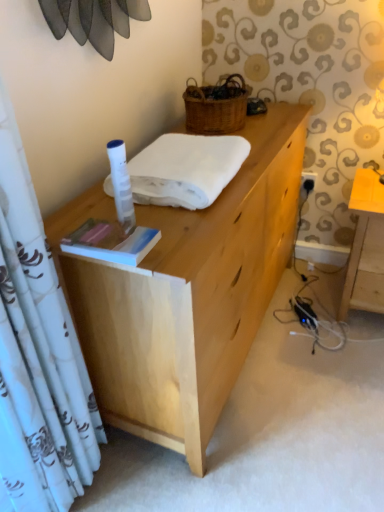
I want to click on natural wood desk at center, so click(x=186, y=292).

Locate an element on the screen. This screenshot has height=512, width=384. white floral fabric curtain at left is located at coordinates (37, 357).

Describe the element at coordinates (216, 106) in the screenshot. I see `woven brown picnic basket at upper center` at that location.

What is the approximate height of light brown wooden table at right?

light brown wooden table at right is 23.56 inches tall.

The width and height of the screenshot is (384, 512). Describe the element at coordinates (365, 247) in the screenshot. I see `light brown wooden table at right` at that location.

Where is `white plastic power outlet at lower right`? The height and width of the screenshot is (512, 384). white plastic power outlet at lower right is located at coordinates (308, 181).

Find the location of a particular element. This screenshot has width=384, height=512. hardcover book at center is located at coordinates (111, 241).

Is woven brown picnic basket at upper center bigger or smaller than white soft towel at center?

Clearly, woven brown picnic basket at upper center is smaller in size than white soft towel at center.

From the picture: How far apart are woven brown picnic basket at upper center and white soft towel at center?

woven brown picnic basket at upper center and white soft towel at center are 39.42 centimeters apart.

I want to click on picnic basket that is on the right side of white soft towel at center, so click(x=216, y=106).

Does woven brown picnic basket at upper center have a lesser width compared to white soft towel at center?

Indeed, woven brown picnic basket at upper center has a lesser width compared to white soft towel at center.

Is white soft towel at center in contact with woven brown picnic basket at upper center?

They are not placed beside each other.

Looking at their sizes, would you say white soft towel at center is wider or thinner than woven brown picnic basket at upper center?

Considering their sizes, white soft towel at center looks broader than woven brown picnic basket at upper center.

Measure the distance from white soft towel at center to woven brown picnic basket at upper center.

white soft towel at center is 15.52 inches away from woven brown picnic basket at upper center.

Who is more distant, white soft towel at center or woven brown picnic basket at upper center?

woven brown picnic basket at upper center is further away from the camera.

Does hardcover book at center appear on the right side of white floral fabric curtain at left?

Indeed, hardcover book at center is positioned on the right side of white floral fabric curtain at left.

Is hardcover book at center behind white floral fabric curtain at left?

Yes, it is behind white floral fabric curtain at left.

From the image's perspective, is hardcover book at center beneath white floral fabric curtain at left?

No, from the image's perspective, hardcover book at center is not beneath white floral fabric curtain at left.

Measure the distance from hardcover book at center to white floral fabric curtain at left.

14.01 inches.

What are the coordinates of `power outlet lying below the woven brown picnic basket at upper center (from the image's perspective)` in the screenshot? It's located at (308, 181).

Can you tell me how much white plastic power outlet at lower right and woven brown picnic basket at upper center differ in facing direction?

91.1 degrees separate the facing orientations of white plastic power outlet at lower right and woven brown picnic basket at upper center.

Is there a large distance between white plastic power outlet at lower right and woven brown picnic basket at upper center?

No, white plastic power outlet at lower right is not far away from woven brown picnic basket at upper center.

Considering the sizes of objects light brown wooden table at right and white floral fabric curtain at left in the image provided, who is smaller, light brown wooden table at right or white floral fabric curtain at left?

Smaller between the two is white floral fabric curtain at left.

From a real-world perspective, is light brown wooden table at right over white floral fabric curtain at left?

No, from a real-world perspective, light brown wooden table at right is not on top of white floral fabric curtain at left.

In order to click on curtain above the light brown wooden table at right (from a real-world perspective) in this screenshot , I will do `click(37, 357)`.

Could you tell me if white soft towel at center is facing natural wood desk at center?

No, white soft towel at center is not aimed at natural wood desk at center.

From a real-world perspective, is white soft towel at center under natural wood desk at center?

No, from a real-world perspective, white soft towel at center is not beneath natural wood desk at center.

How different are the orientations of white soft towel at center and natural wood desk at center in degrees?

They differ by 0.721 degrees in their facing directions.

Considering the relative sizes of white soft towel at center and natural wood desk at center in the image provided, is white soft towel at center bigger than natural wood desk at center?

No.

Considering the relative positions of white soft towel at center and white floral fabric curtain at left in the image provided, is white soft towel at center to the right of white floral fabric curtain at left from the viewer's perspective?

Indeed, white soft towel at center is positioned on the right side of white floral fabric curtain at left.

Between white soft towel at center and white floral fabric curtain at left, which one has smaller size?

With smaller size is white soft towel at center.

Is white soft towel at center shorter than white floral fabric curtain at left?

Yes.

Is white soft towel at center completely or partially outside of white floral fabric curtain at left?

white soft towel at center lies outside white floral fabric curtain at left's area.

The image size is (384, 512). Identify the location of linen lying in front of the woven brown picnic basket at upper center. (186, 169).

Image resolution: width=384 pixels, height=512 pixels. Find the location of `linen on the left of woven brown picnic basket at upper center`. linen on the left of woven brown picnic basket at upper center is located at coordinates (186, 169).

Estimate the real-world distances between objects in this image. Which object is further from hardcover book at center, white floral fabric curtain at left or white plastic power outlet at lower right?

Based on the image, white plastic power outlet at lower right appears to be further to hardcover book at center.

Looking at the image, which one is located closer to woven brown picnic basket at upper center, hardcover book at center or white soft towel at center?

The object closer to woven brown picnic basket at upper center is white soft towel at center.

Based on their spatial positions, is white soft towel at center or white plastic power outlet at lower right closer to light brown wooden table at right?

white plastic power outlet at lower right.

Considering their positions, is light brown wooden table at right positioned further to white plastic power outlet at lower right than natural wood desk at center?

natural wood desk at center.

Looking at the image, which one is located further to woven brown picnic basket at upper center, white soft towel at center or white floral fabric curtain at left?

Among the two, white floral fabric curtain at left is located further to woven brown picnic basket at upper center.

Looking at this image, when comparing their distances from white floral fabric curtain at left, does woven brown picnic basket at upper center or white plastic power outlet at lower right seem further?

The object further to white floral fabric curtain at left is white plastic power outlet at lower right.

Estimate the real-world distances between objects in this image. Which object is closer to white plastic power outlet at lower right, white floral fabric curtain at left or woven brown picnic basket at upper center?

The object closer to white plastic power outlet at lower right is woven brown picnic basket at upper center.

Based on their spatial positions, is hardcover book at center or woven brown picnic basket at upper center closer to white soft towel at center?

The object closer to white soft towel at center is hardcover book at center.

You are a GUI agent. You are given a task and a screenshot of the screen. Output one action in this format:
    pyautogui.click(x=<x>, y=<y>)
    Task: Click on the picnic basket situated between hardcover book at center and light brown wooden table at right from left to right
    
    Given the screenshot: What is the action you would take?
    pyautogui.click(x=216, y=106)

You are a GUI agent. You are given a task and a screenshot of the screen. Output one action in this format:
    pyautogui.click(x=<x>, y=<y>)
    Task: Click on the linen located between hardcover book at center and white plastic power outlet at lower right in the depth direction
    This screenshot has width=384, height=512.
    Given the screenshot: What is the action you would take?
    pyautogui.click(x=186, y=169)

Locate an element on the screen. This screenshot has height=512, width=384. linen positioned between natural wood desk at center and white plastic power outlet at lower right from near to far is located at coordinates (186, 169).

Locate an element on the screen. book between white floral fabric curtain at left and woven brown picnic basket at upper center along the z-axis is located at coordinates (111, 241).